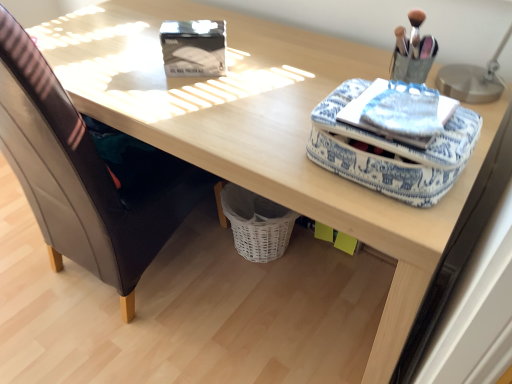
What are the coordinates of `free space to the left of metallic silver table lamp at upper right` in the screenshot? It's located at 350,67.